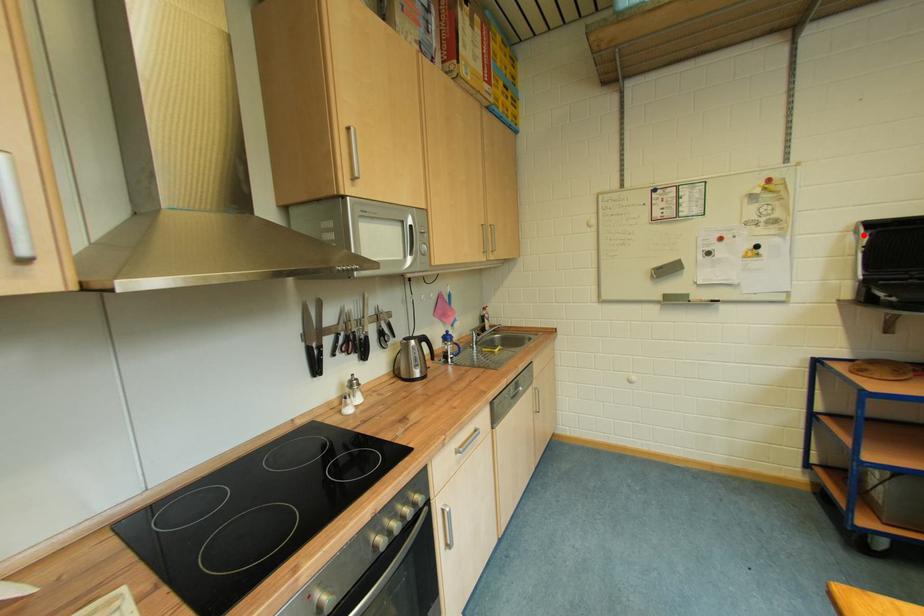
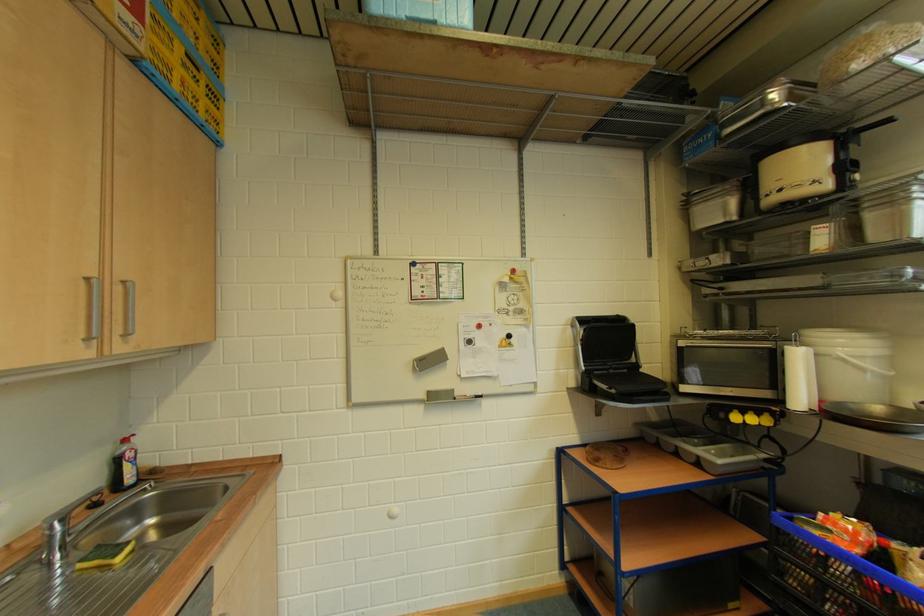
Where in the second image is the point corresponding to the highlighted location from the first image?

(579, 329)